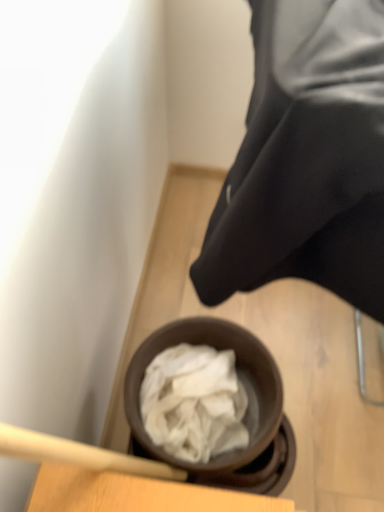
Question: Should I look upward or downward to see black satin shirt at upper right?

Choices:
 (A) down
 (B) up

Answer: (B)